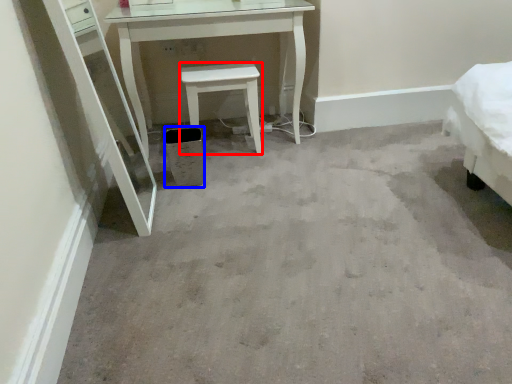
Question: Which object appears closest to the camera in this image, stool (highlighted by a red box) or trash bin/can (highlighted by a blue box)?

Choices:
 (A) stool
 (B) trash bin/can

Answer: (B)